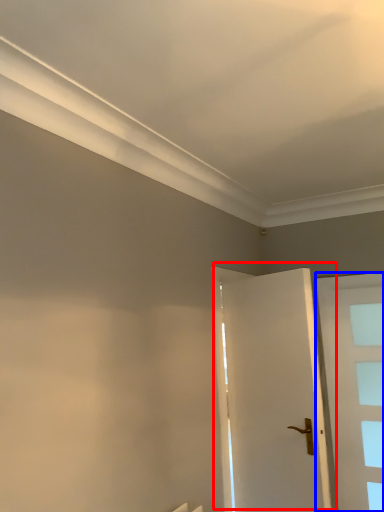
Question: Which of the following is the farthest to the observer, door (highlighted by a red box) or door (highlighted by a blue box)?

Choices:
 (A) door
 (B) door

Answer: (B)